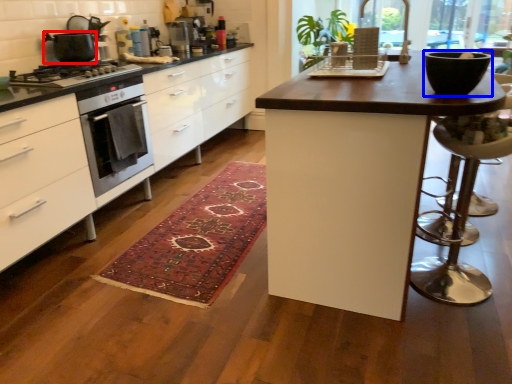
Question: Among these objects, which one is farthest to the camera, kitchen appliance (highlighted by a red box) or bowl (highlighted by a blue box)?

Choices:
 (A) kitchen appliance
 (B) bowl

Answer: (A)